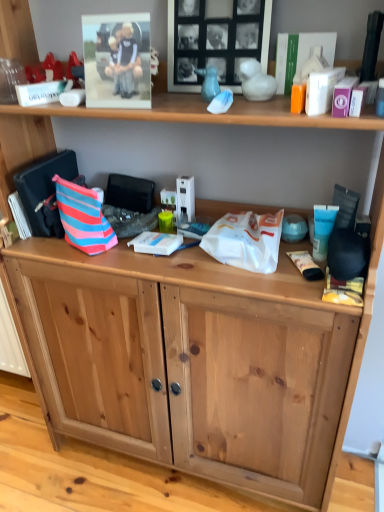
Question: From the image's perspective, is natural wood cabinet at lower center located beneath matte plastic photo frame at upper left, which is the 1th picture frame in left-to-right order?

Choices:
 (A) yes
 (B) no

Answer: (A)

Question: Considering the relative sizes of natural wood cabinet at lower center and matte plastic photo frame at upper left, the second picture frame in the right-to-left sequence, in the image provided, is natural wood cabinet at lower center bigger than matte plastic photo frame at upper left, the second picture frame in the right-to-left sequence,?

Choices:
 (A) no
 (B) yes

Answer: (B)

Question: Is natural wood cabinet at lower center taller than matte plastic photo frame at upper left, the second picture frame in the right-to-left sequence?

Choices:
 (A) no
 (B) yes

Answer: (A)

Question: Is natural wood cabinet at lower center at the left side of matte plastic photo frame at upper left, the second picture frame in the right-to-left sequence?

Choices:
 (A) no
 (B) yes

Answer: (B)

Question: Is natural wood cabinet at lower center in front of matte plastic photo frame at upper left, which is the 1th picture frame in left-to-right order?

Choices:
 (A) no
 (B) yes

Answer: (A)

Question: Could matte plastic photo frame at upper left, the second picture frame in the right-to-left sequence, be considered to be inside natural wood cabinet at lower center?

Choices:
 (A) yes
 (B) no

Answer: (B)

Question: Is there a large distance between black matte picture frame at upper center, positioned as the first picture frame in right-to-left order, and white plastic bag at center?

Choices:
 (A) yes
 (B) no

Answer: (B)

Question: Would you say black matte picture frame at upper center, positioned as the first picture frame in right-to-left order, is outside white plastic bag at center?

Choices:
 (A) no
 (B) yes

Answer: (B)

Question: Does black matte picture frame at upper center, positioned as the first picture frame in right-to-left order, appear on the right side of white plastic bag at center?

Choices:
 (A) yes
 (B) no

Answer: (B)

Question: From the image's perspective, is black matte picture frame at upper center, positioned as the first picture frame in right-to-left order, on white plastic bag at center?

Choices:
 (A) no
 (B) yes

Answer: (B)

Question: Is black matte picture frame at upper center, which is the second picture frame from left to right, further to camera compared to white plastic bag at center?

Choices:
 (A) yes
 (B) no

Answer: (B)

Question: Is black matte picture frame at upper center, positioned as the first picture frame in right-to-left order, bigger than white plastic bag at center?

Choices:
 (A) yes
 (B) no

Answer: (A)

Question: Is black matte picture frame at upper center, which is the second picture frame from left to right, far from matte plastic photo frame at upper left, which is the 1th picture frame in left-to-right order?

Choices:
 (A) yes
 (B) no

Answer: (B)